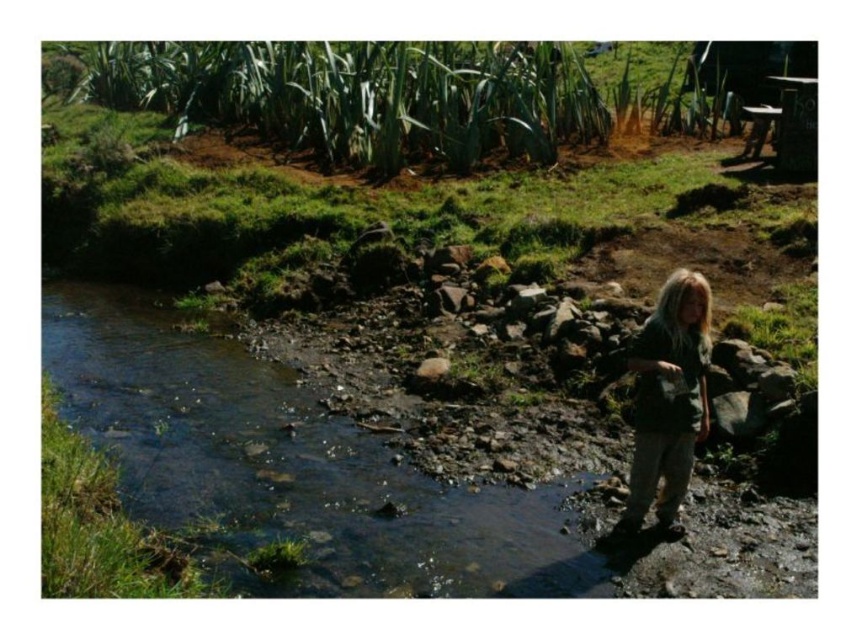
You are a hiker trying to cross the stream. You see the clear water at stream center and the green fabric shirt at lower right. Which object is closer to the ground?

The clear water at stream center is closer to the ground because it is located below the green fabric shirt at lower right.

You are a hiker carrying a 3.5 feet wide backpack and want to cross the stream. The clear water at stream center and the green fabric shirt at lower right are in your path. Can your backpack fit between them without touching either?

The distance between the clear water at stream center and the green fabric shirt at lower right is 8.63 feet. Since your backpack is only 3.5 feet wide, there is enough space to fit it between them without touching either object.

You are standing at the edge of the stream and want to reach a specific point in the water marked as point (313, 419). If your maximum comfortable walking distance in water is 10 meters, can you safely walk to that point?

The distance of point (313, 419) from camera is 9.24 meters, so yes, you can safely walk to that point since it is within your maximum comfortable walking distance of 10 meters.